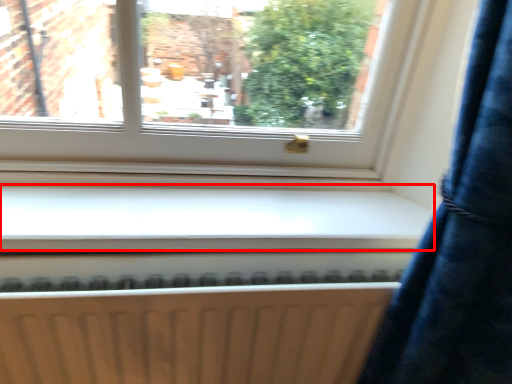
Question: In this image, where is window sill (annotated by the red box) located relative to radiator?

Choices:
 (A) left
 (B) right

Answer: (B)